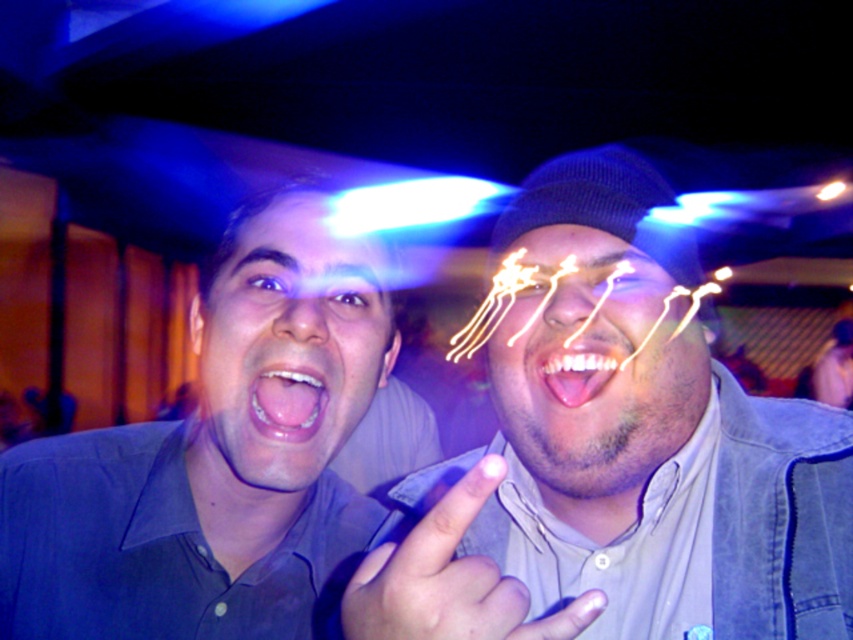
Question: Does denim jacket at right have a lesser width compared to matte gray shirt at center?

Choices:
 (A) no
 (B) yes

Answer: (A)

Question: Can you confirm if denim jacket at right is bigger than smooth pink tongue at center?

Choices:
 (A) yes
 (B) no

Answer: (A)

Question: Which of these objects is positioned closest to the matte gray shirt at center?

Choices:
 (A) shiny metallic face at center
 (B) denim jacket at right
 (C) matte blue shirt at left
 (D) smooth pink tongue at center

Answer: (C)

Question: Which point is farther to the camera?

Choices:
 (A) pink glossy tongue at center
 (B) matte blue shirt at left
 (C) matte gray shirt at center

Answer: (C)

Question: Which of these objects is positioned closest to the matte gray shirt at center?

Choices:
 (A) matte blue shirt at left
 (B) shiny metallic face at center

Answer: (A)

Question: Observing the image, what is the correct spatial positioning of matte blue shirt at left in reference to shiny metallic face at center?

Choices:
 (A) above
 (B) below

Answer: (B)